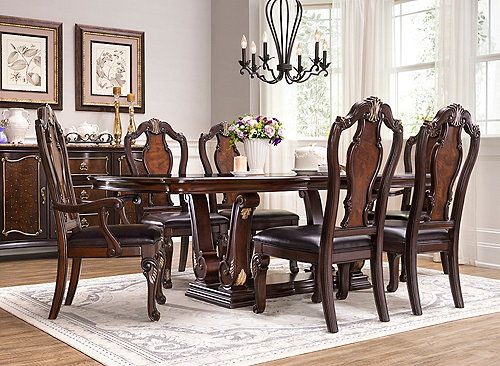
Where is `chairs`? chairs is located at coordinates (82, 241), (146, 141), (221, 146), (363, 173), (431, 174), (410, 158).